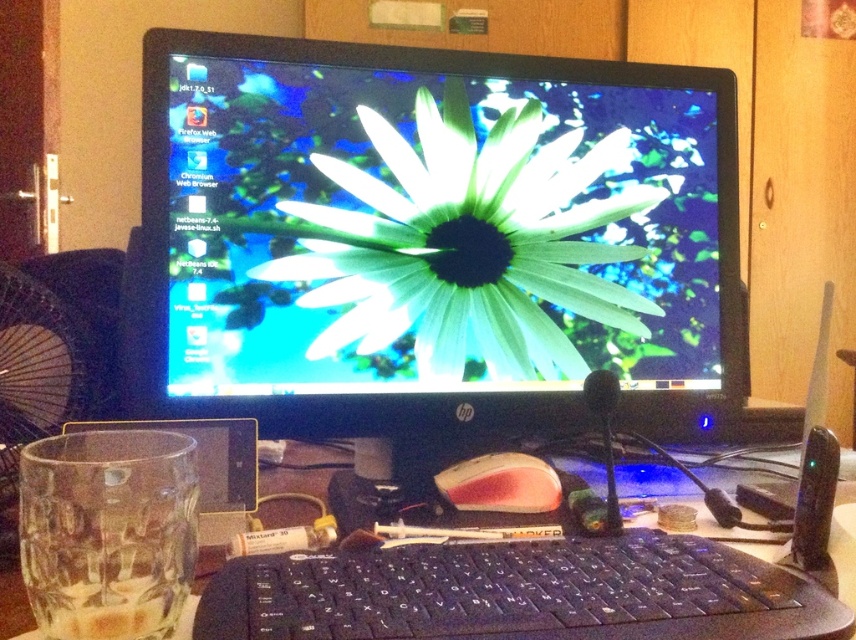
Question: Which of the following is the farthest from the observer?

Choices:
 (A) black plastic keyboard at center
 (B) pink matte mouse at center
 (C) black plastic keyboard at lower center

Answer: (B)

Question: Which object is positioned farthest from the pink matte mouse at center?

Choices:
 (A) green matte flower at center
 (B) black plastic keyboard at center

Answer: (A)

Question: Which of the following is the farthest from the observer?

Choices:
 (A) black plastic keyboard at center
 (B) black plastic keyboard at lower center
 (C) green matte flower at center

Answer: (C)

Question: Can you confirm if black plastic keyboard at lower center is bigger than pink matte mouse at center?

Choices:
 (A) yes
 (B) no

Answer: (A)

Question: In this image, where is black plastic keyboard at lower center located relative to pink matte mouse at center?

Choices:
 (A) left
 (B) right

Answer: (A)

Question: Considering the relative positions of black plastic keyboard at center and pink matte mouse at center in the image provided, where is black plastic keyboard at center located with respect to pink matte mouse at center?

Choices:
 (A) above
 (B) below

Answer: (B)